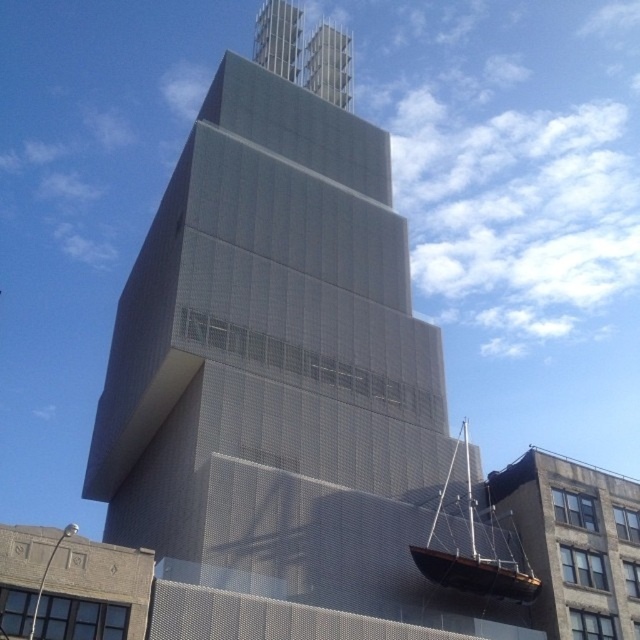
Question: Which point is farther to the camera?

Choices:
 (A) gray metallic building at center
 (B) wooden sailboat at lower right

Answer: (B)

Question: Is gray metallic building at center to the left of wooden sailboat at lower right from the viewer's perspective?

Choices:
 (A) no
 (B) yes

Answer: (B)

Question: Is gray metallic building at center above wooden sailboat at lower right?

Choices:
 (A) yes
 (B) no

Answer: (A)

Question: Which point is farther to the camera?

Choices:
 (A) (470, 560)
 (B) (236, 212)

Answer: (B)

Question: Can you confirm if gray metallic building at center is positioned to the right of wooden sailboat at lower right?

Choices:
 (A) yes
 (B) no

Answer: (B)